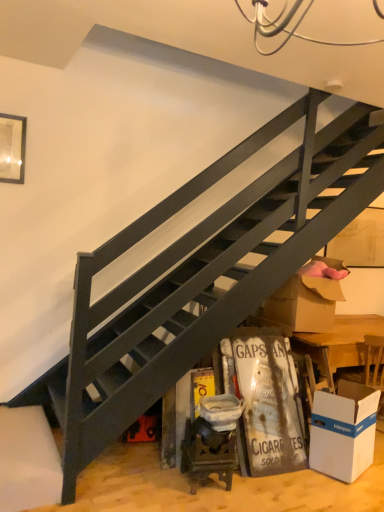
Question: Is white cardboard box at lower right not close to brown cardboard box at lower right?

Choices:
 (A) yes
 (B) no

Answer: (B)

Question: Is white cardboard box at lower right located outside brown cardboard box at lower right?

Choices:
 (A) yes
 (B) no

Answer: (A)

Question: Is white cardboard box at lower right bigger than brown cardboard box at lower right?

Choices:
 (A) no
 (B) yes

Answer: (A)

Question: Is white cardboard box at lower right directly adjacent to brown cardboard box at lower right?

Choices:
 (A) yes
 (B) no

Answer: (B)

Question: From the image's perspective, does white cardboard box at lower right appear lower than brown cardboard box at lower right?

Choices:
 (A) yes
 (B) no

Answer: (A)

Question: From the image's perspective, is white cardboard box at lower right on brown cardboard box at lower right?

Choices:
 (A) no
 (B) yes

Answer: (A)

Question: Is there a large distance between brown cardboard box at lower right and white cardboard box at lower right?

Choices:
 (A) yes
 (B) no

Answer: (B)

Question: Is white cardboard box at lower right a part of brown cardboard box at lower right?

Choices:
 (A) no
 (B) yes

Answer: (A)

Question: From a real-world perspective, is brown cardboard box at lower right positioned under white cardboard box at lower right based on gravity?

Choices:
 (A) yes
 (B) no

Answer: (B)

Question: Is brown cardboard box at lower right placed right next to white cardboard box at lower right?

Choices:
 (A) no
 (B) yes

Answer: (A)

Question: Can you confirm if brown cardboard box at lower right is positioned to the left of white cardboard box at lower right?

Choices:
 (A) yes
 (B) no

Answer: (A)

Question: From the image's perspective, is brown cardboard box at lower right beneath white cardboard box at lower right?

Choices:
 (A) no
 (B) yes

Answer: (A)

Question: Would you say brown cardboard box at lower right is inside or outside white cardboard box at lower right?

Choices:
 (A) outside
 (B) inside

Answer: (A)